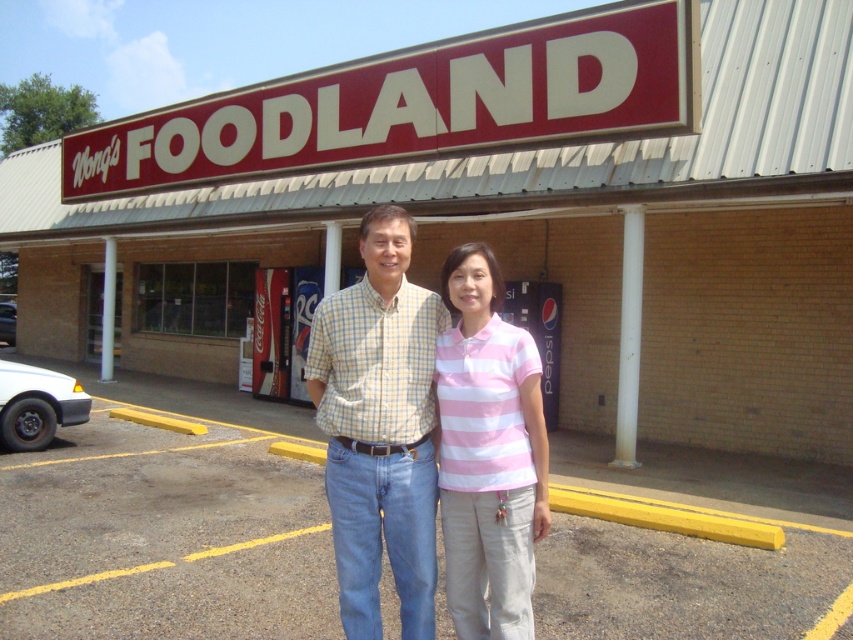
Question: Estimate the real-world distances between objects in this image. Which object is closer to the pink striped shirt at center?

Choices:
 (A) red plastic sign at upper center
 (B) checkered cotton shirt at center

Answer: (B)

Question: Estimate the real-world distances between objects in this image. Which object is closer to the red plastic sign at upper center?

Choices:
 (A) white brick building at center
 (B) checkered cotton shirt at center
 (C) pink striped shirt at center

Answer: (A)

Question: Does white brick building at center have a smaller size compared to pink striped shirt at center?

Choices:
 (A) no
 (B) yes

Answer: (A)

Question: Is white brick building at center smaller than pink striped shirt at center?

Choices:
 (A) no
 (B) yes

Answer: (A)

Question: Which is nearer to the pink striped shirt at center?

Choices:
 (A) white brick building at center
 (B) red plastic sign at upper center
 (C) checkered cotton shirt at center

Answer: (C)

Question: Where is white brick building at center located in relation to red plastic sign at upper center in the image?

Choices:
 (A) below
 (B) above

Answer: (A)